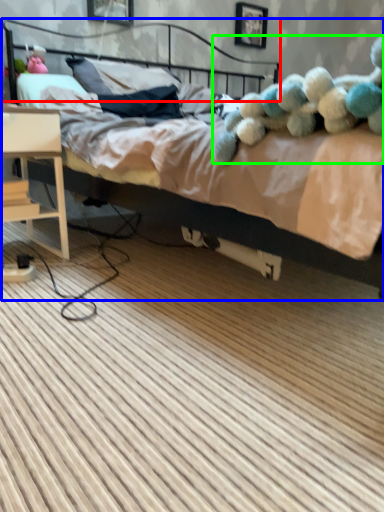
Question: Based on their relative distances, which object is farther from headboard (highlighted by a red box)? Choose from bed (highlighted by a blue box) and teddy (highlighted by a green box).

Choices:
 (A) bed
 (B) teddy

Answer: (B)